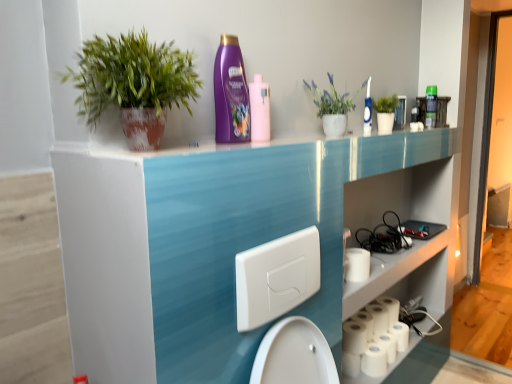
Question: Considering the relative sizes of green matte plant at upper left, the first houseplant from the left, and white matte toilet paper at lower right, the fourth toilet paper when ordered from right to left, in the image provided, is green matte plant at upper left, the first houseplant from the left, smaller than white matte toilet paper at lower right, the fourth toilet paper when ordered from right to left,?

Choices:
 (A) no
 (B) yes

Answer: (A)

Question: Is green matte plant at upper left, the 2th houseplant viewed from the right, not near white matte toilet paper at lower right, marked as the 1th toilet paper in a left-to-right arrangement?

Choices:
 (A) no
 (B) yes

Answer: (B)

Question: Does green matte plant at upper left, the 2th houseplant viewed from the right, have a lesser width compared to white matte toilet paper at lower right, the fourth toilet paper when ordered from right to left?

Choices:
 (A) no
 (B) yes

Answer: (A)

Question: Considering the relative sizes of green matte plant at upper left, the 2th houseplant viewed from the right, and white matte toilet paper at lower right, marked as the 1th toilet paper in a left-to-right arrangement, in the image provided, is green matte plant at upper left, the 2th houseplant viewed from the right, taller than white matte toilet paper at lower right, marked as the 1th toilet paper in a left-to-right arrangement,?

Choices:
 (A) no
 (B) yes

Answer: (B)

Question: Does green matte plant at upper left, which ranks as the 2th houseplant in back-to-front order, have a greater width compared to white matte toilet paper at lower right, the fourth toilet paper when ordered from right to left?

Choices:
 (A) yes
 (B) no

Answer: (A)

Question: Is point (370, 124) positioned closer to the camera than point (343, 329)?

Choices:
 (A) farther
 (B) closer

Answer: (A)

Question: From the image's perspective, is blue plastic toothbrush at upper right, arranged as the 2th cleaning product when viewed from the back, located above or below white matte toilet paper at lower right, marked as the 1th toilet paper in a left-to-right arrangement?

Choices:
 (A) above
 (B) below

Answer: (A)

Question: Based on their sizes in the image, would you say blue plastic toothbrush at upper right, positioned as the third cleaning product in front-to-back order, is bigger or smaller than white matte toilet paper at lower right, marked as the 1th toilet paper in a left-to-right arrangement?

Choices:
 (A) big
 (B) small

Answer: (B)

Question: Is blue plastic toothbrush at upper right, positioned as the 2th cleaning product in right-to-left order, wider or thinner than white matte toilet paper at lower right, the fourth toilet paper when ordered from right to left?

Choices:
 (A) wide
 (B) thin

Answer: (B)

Question: Looking at their shapes, would you say white matte toilet paper at lower right, the third toilet paper when ordered from left to right, is wider or thinner than white matte paper towel at lower right?

Choices:
 (A) wide
 (B) thin

Answer: (A)

Question: Would you say white matte toilet paper at lower right, the third toilet paper when ordered from left to right, is to the left or to the right of white matte paper towel at lower right in the picture?

Choices:
 (A) left
 (B) right

Answer: (B)

Question: Is white matte toilet paper at lower right, the third toilet paper when ordered from left to right, spatially inside white matte paper towel at lower right, or outside of it?

Choices:
 (A) inside
 (B) outside

Answer: (B)

Question: Considering the positions of point (369, 352) and point (351, 269), is point (369, 352) closer or farther from the camera than point (351, 269)?

Choices:
 (A) farther
 (B) closer

Answer: (A)

Question: From the image's perspective, relative to purple glossy shampoo at upper center, the fourth cleaning product viewed from the right, is white matte toilet paper at lower right, which is the first toilet paper in right-to-left order, above or below?

Choices:
 (A) below
 (B) above

Answer: (A)

Question: Looking at the image, does white matte toilet paper at lower right, which is the first toilet paper in right-to-left order, seem bigger or smaller compared to purple glossy shampoo at upper center, the fourth cleaning product positioned from the back?

Choices:
 (A) small
 (B) big

Answer: (A)